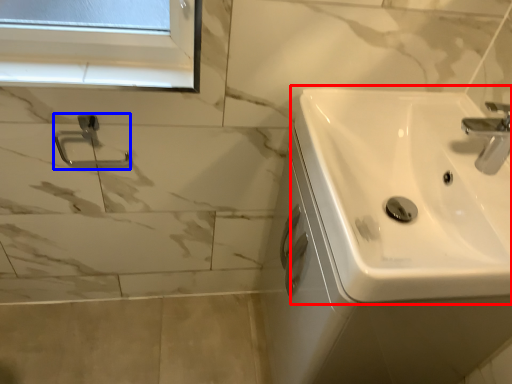
Question: Among these objects, which one is nearest to the camera, sink (highlighted by a red box) or shower (highlighted by a blue box)?

Choices:
 (A) sink
 (B) shower

Answer: (A)